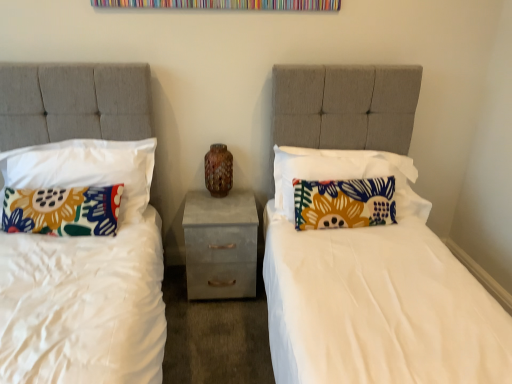
Locate an element on the screen. The width and height of the screenshot is (512, 384). floral fabric pillow at left, which is the 4th pillow in right-to-left order is located at coordinates (63, 211).

What do you see at coordinates (218, 170) in the screenshot? I see `brown speckled vase at center` at bounding box center [218, 170].

You are a GUI agent. You are given a task and a screenshot of the screen. Output one action in this format:
    pyautogui.click(x=<x>, y=<y>)
    Task: Click on the floral fabric pillow at left, which is the 3th pillow from right to left
    
    Given the screenshot: What is the action you would take?
    tap(86, 168)

Where is `floral fabric pillow at left, which is the 4th pillow in right-to-left order`? The image size is (512, 384). floral fabric pillow at left, which is the 4th pillow in right-to-left order is located at coordinates (63, 211).

Which object is positioned more to the left, concrete textured nightstand at center or floral fabric pillow at right, which is counted as the 3th pillow, starting from the left?

concrete textured nightstand at center is more to the left.

Consider the image. Would you say concrete textured nightstand at center is outside floral fabric pillow at right, which is counted as the 3th pillow, starting from the left?

concrete textured nightstand at center is positioned outside floral fabric pillow at right, which is counted as the 3th pillow, starting from the left.

From a real-world perspective, which object stands above the other?

floral fabric pillow at right, which is counted as the 3th pillow, starting from the left, from a real-world perspective.

From the picture: Which point is more forward, (83, 197) or (232, 160)?

The point (83, 197) is closer to the camera.

From the image's perspective, is floral fabric pillow at left, the 1th pillow viewed from the left, above brown speckled vase at center?

No, from the image's perspective, floral fabric pillow at left, the 1th pillow viewed from the left, is not over brown speckled vase at center.

Is floral fabric pillow at left, which is the 4th pillow in right-to-left order, far from brown speckled vase at center?

floral fabric pillow at left, which is the 4th pillow in right-to-left order, is near brown speckled vase at center, not far away.

Is floral fabric pillow at left, the 1th pillow viewed from the left, wider than brown speckled vase at center?

Yes.

Can floral fabric pillow at right, the fourth pillow in the left-to-right sequence, be found inside concrete textured nightstand at center?

No, floral fabric pillow at right, the fourth pillow in the left-to-right sequence, is not a part of concrete textured nightstand at center.

Is concrete textured nightstand at center far from floral fabric pillow at right, the fourth pillow in the left-to-right sequence?

No.

Considering the relative sizes of concrete textured nightstand at center and floral fabric pillow at right, which appears as the 1th pillow when viewed from the right, in the image provided, is concrete textured nightstand at center thinner than floral fabric pillow at right, which appears as the 1th pillow when viewed from the right,?

No, concrete textured nightstand at center is not thinner than floral fabric pillow at right, which appears as the 1th pillow when viewed from the right.

Between concrete textured nightstand at center and floral fabric pillow at right, the fourth pillow in the left-to-right sequence, which one has more height?

floral fabric pillow at right, the fourth pillow in the left-to-right sequence.

Between brown speckled vase at center and floral fabric pillow at right, which appears as the 1th pillow when viewed from the right, which one has more height?

With more height is floral fabric pillow at right, which appears as the 1th pillow when viewed from the right.

Is point (212, 172) positioned before point (411, 201)?

No, (212, 172) is behind (411, 201).

Looking at this image, from the image's perspective, is brown speckled vase at center located above or below floral fabric pillow at right, the fourth pillow in the left-to-right sequence?

Based on their image positions, brown speckled vase at center is located above floral fabric pillow at right, the fourth pillow in the left-to-right sequence.

Which is more to the right, brown speckled vase at center or floral fabric pillow at right, which appears as the 1th pillow when viewed from the right?

From the viewer's perspective, floral fabric pillow at right, which appears as the 1th pillow when viewed from the right, appears more on the right side.

Which of these two, floral fabric pillow at left, the 1th pillow viewed from the left, or concrete textured nightstand at center, is bigger?

Bigger between the two is concrete textured nightstand at center.

Considering the points (108, 215) and (230, 208), which point is in front, point (108, 215) or point (230, 208)?

The point (108, 215) is in front.

Looking at this image, from a real-world perspective, is floral fabric pillow at left, which is the 4th pillow in right-to-left order, below concrete textured nightstand at center?

No, from a real-world perspective, floral fabric pillow at left, which is the 4th pillow in right-to-left order, is not beneath concrete textured nightstand at center.

From the image's perspective, between floral fabric pillow at left, which is the 4th pillow in right-to-left order, and concrete textured nightstand at center, who is located below?

concrete textured nightstand at center is shown below in the image.

Is floral fabric pillow at left, which is the 3th pillow from right to left, looking in the opposite direction of brown speckled vase at center?

No, brown speckled vase at center is not at the back of floral fabric pillow at left, which is the 3th pillow from right to left.

Can we say floral fabric pillow at left, the second pillow viewed from the left, lies outside brown speckled vase at center?

Absolutely, floral fabric pillow at left, the second pillow viewed from the left, is external to brown speckled vase at center.

Considering the points (149, 195) and (214, 196), which point is behind, point (149, 195) or point (214, 196)?

The point (214, 196) is farther from the camera.

Based on the photo, is floral fabric pillow at left, which is the 3th pillow from right to left, far away from brown speckled vase at center?

That's not correct — floral fabric pillow at left, which is the 3th pillow from right to left, is a little close to brown speckled vase at center.

From the image's perspective, which pillow is the 1st one above the floral fabric pillow at left, which is the 4th pillow in right-to-left order? Please provide its 2D coordinates.

[(344, 203)]

Which object is positioned more to the left, floral fabric pillow at left, which is the 4th pillow in right-to-left order, or floral fabric pillow at right, which is counted as the 2th pillow, starting from the right?

floral fabric pillow at left, which is the 4th pillow in right-to-left order.

From a real-world perspective, is floral fabric pillow at left, which is the 4th pillow in right-to-left order, under floral fabric pillow at right, which is counted as the 2th pillow, starting from the right?

Yes, from a real-world perspective, floral fabric pillow at left, which is the 4th pillow in right-to-left order, is below floral fabric pillow at right, which is counted as the 2th pillow, starting from the right.

Where is `nightstand that is on the left side of floral fabric pillow at right, which is counted as the 3th pillow, starting from the left`? The height and width of the screenshot is (384, 512). nightstand that is on the left side of floral fabric pillow at right, which is counted as the 3th pillow, starting from the left is located at coordinates (220, 245).

The image size is (512, 384). Find the location of `the 3rd pillow in front of the brown speckled vase at center`. the 3rd pillow in front of the brown speckled vase at center is located at coordinates (63, 211).

Estimate the real-world distances between objects in this image. Which object is closer to brown speckled vase at center, floral fabric pillow at left, which is the 4th pillow in right-to-left order, or concrete textured nightstand at center?

concrete textured nightstand at center lies closer to brown speckled vase at center than the other object.

Looking at the image, which one is located further to concrete textured nightstand at center, floral fabric pillow at left, which is the 4th pillow in right-to-left order, or floral fabric pillow at left, which is the 3th pillow from right to left?

floral fabric pillow at left, which is the 4th pillow in right-to-left order, is positioned further to the anchor concrete textured nightstand at center.

Looking at the image, which one is located further to floral fabric pillow at left, which is the 3th pillow from right to left, floral fabric pillow at left, which is the 4th pillow in right-to-left order, or floral fabric pillow at right, which appears as the 1th pillow when viewed from the right?

Based on the image, floral fabric pillow at right, which appears as the 1th pillow when viewed from the right, appears to be further to floral fabric pillow at left, which is the 3th pillow from right to left.

Looking at the image, which one is located closer to floral fabric pillow at left, the second pillow viewed from the left, floral fabric pillow at left, which is the 4th pillow in right-to-left order, or brown speckled vase at center?

Among the two, floral fabric pillow at left, which is the 4th pillow in right-to-left order, is located nearer to floral fabric pillow at left, the second pillow viewed from the left.

Which object lies nearer to the anchor point brown speckled vase at center, floral fabric pillow at left, which is the 3th pillow from right to left, or floral fabric pillow at right, which is counted as the 3th pillow, starting from the left?

floral fabric pillow at left, which is the 3th pillow from right to left, is positioned closer to the anchor brown speckled vase at center.

From the image, which object appears to be nearer to floral fabric pillow at left, the second pillow viewed from the left, brown speckled vase at center or concrete textured nightstand at center?

concrete textured nightstand at center is positioned closer to the anchor floral fabric pillow at left, the second pillow viewed from the left.

Considering their positions, is floral fabric pillow at right, which appears as the 1th pillow when viewed from the right, positioned closer to floral fabric pillow at left, which is the 3th pillow from right to left, than brown speckled vase at center?

brown speckled vase at center lies closer to floral fabric pillow at left, which is the 3th pillow from right to left, than the other object.

Which object lies nearer to the anchor point brown speckled vase at center, concrete textured nightstand at center or floral fabric pillow at right, which appears as the 1th pillow when viewed from the right?

concrete textured nightstand at center.

Image resolution: width=512 pixels, height=384 pixels. I want to click on vase between floral fabric pillow at left, the 1th pillow viewed from the left, and concrete textured nightstand at center from left to right, so click(x=218, y=170).

Identify the location of nightstand located between floral fabric pillow at left, the second pillow viewed from the left, and floral fabric pillow at right, which is counted as the 2th pillow, starting from the right, in the left-right direction. Image resolution: width=512 pixels, height=384 pixels. (220, 245).

I want to click on nightstand between floral fabric pillow at left, the 1th pillow viewed from the left, and floral fabric pillow at right, which appears as the 1th pillow when viewed from the right, so click(220, 245).

At what (x,y) coordinates should I click in order to perform the action: click on pillow located between floral fabric pillow at left, which is the 4th pillow in right-to-left order, and floral fabric pillow at right, which is counted as the 2th pillow, starting from the right, in the left-right direction. Please return your answer as a coordinate pair (x, y). Looking at the image, I should click on (86, 168).